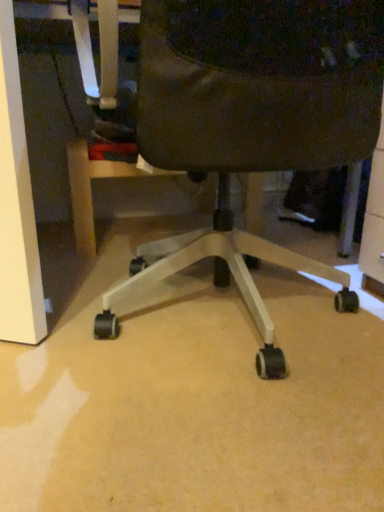
Question: Should I look upward or downward to see black leather chair at center?

Choices:
 (A) down
 (B) up

Answer: (B)